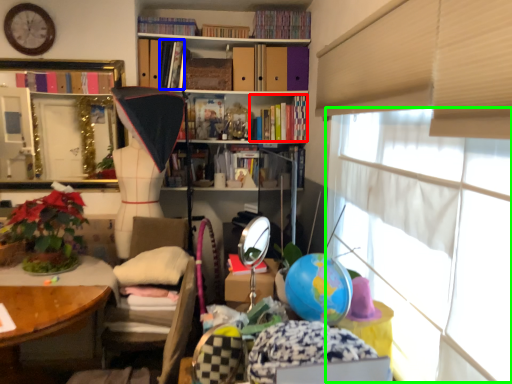
Question: Estimate the real-world distances between objects in this image. Which object is farther from book (highlighted by a red box), book (highlighted by a blue box) or window screen (highlighted by a green box)?

Choices:
 (A) book
 (B) window screen

Answer: (B)